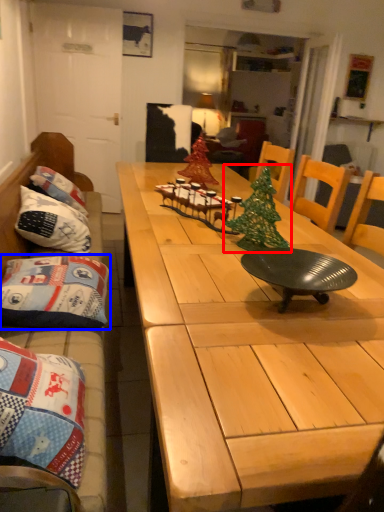
Question: Which of the following is the closest to the observer, christmas tree (highlighted by a red box) or pillow (highlighted by a blue box)?

Choices:
 (A) christmas tree
 (B) pillow

Answer: (A)